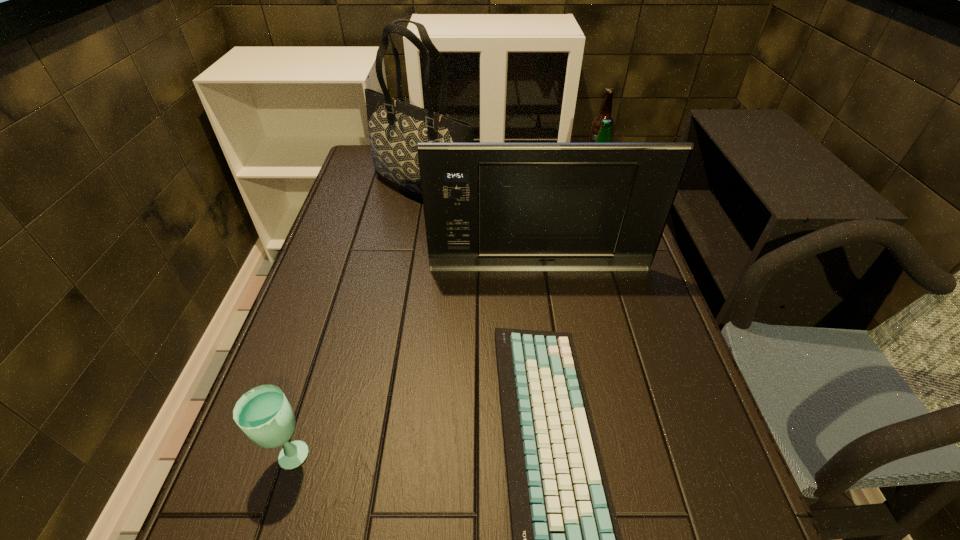
Where is `vacant space located on the label of the nearer beer bottle`? The width and height of the screenshot is (960, 540). vacant space located on the label of the nearer beer bottle is located at coordinates (547, 215).

Where is `free space located 0.260m on the label of the farther beer bottle`? free space located 0.260m on the label of the farther beer bottle is located at coordinates (613, 223).

Locate an element on the screen. vacant region located on the right of the glass is located at coordinates (442, 453).

At what (x,y) coordinates should I click in order to perform the action: click on tote bag positioned at the far edge. Please return your answer as a coordinate pair (x, y). The width and height of the screenshot is (960, 540). Looking at the image, I should click on (395, 127).

I want to click on beer bottle located in the far edge section of the desktop, so (x=605, y=111).

Locate an element on the screen. This screenshot has width=960, height=540. tote bag positioned at the left edge is located at coordinates (395, 127).

Where is `glass located at the left edge`? The image size is (960, 540). glass located at the left edge is located at coordinates (264, 414).

Identify the location of microwave oven positioned at the right edge. The image size is (960, 540). (487, 206).

Where is `object at the far left corner`? object at the far left corner is located at coordinates (395, 127).

You are a GUI agent. You are given a task and a screenshot of the screen. Output one action in this format:
    pyautogui.click(x=<x>, y=<y>)
    Task: Click on the object that is at the far right corner
    This screenshot has height=540, width=960.
    Given the screenshot: What is the action you would take?
    pyautogui.click(x=605, y=111)